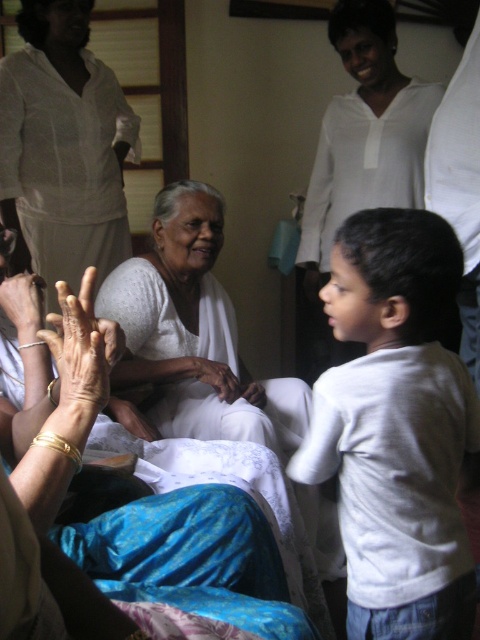
Question: Which object appears farthest from the camera in this image?

Choices:
 (A) smooth white hand at center
 (B) white fabric at center

Answer: (A)

Question: Does dry skin hand at lower left lie in front of gold bracelet at lower left?

Choices:
 (A) yes
 (B) no

Answer: (A)

Question: Does white cloth at center have a greater width compared to smooth white hand at center?

Choices:
 (A) no
 (B) yes

Answer: (B)

Question: Can you confirm if white cotton shirt at right is positioned to the left of smooth white hand at center?

Choices:
 (A) no
 (B) yes

Answer: (A)

Question: Among these points, which one is farthest from the camera?

Choices:
 (A) (220, 384)
 (B) (73, 173)

Answer: (B)

Question: Among these points, which one is farthest from the camera?

Choices:
 (A) (95, 349)
 (B) (206, 572)

Answer: (B)